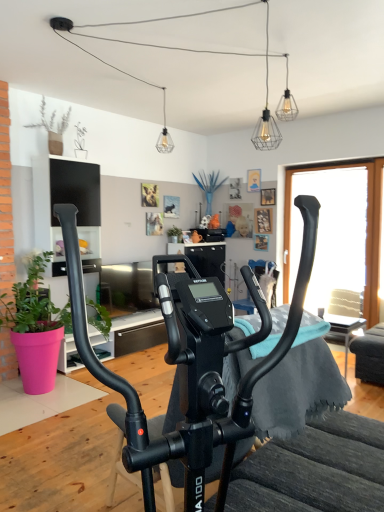
Question: Is black matte stationary bicycle at center inside the boundaries of clear glass pendant light at upper center, marked as the third light fixture in a front-to-back arrangement, or outside?

Choices:
 (A) outside
 (B) inside

Answer: (A)

Question: Based on their sizes in the image, would you say black matte stationary bicycle at center is bigger or smaller than clear glass pendant light at upper center, arranged as the 1th light fixture when viewed from the left?

Choices:
 (A) big
 (B) small

Answer: (A)

Question: Which is nearer to the transparent glass window at right?

Choices:
 (A) wire mesh bulb at upper center, which is the 3th light fixture from left to right
 (B) green matte plant at center, which appears as the second houseplant when viewed from the front
 (C) clear glass pendant light at upper center, marked as the third light fixture in a front-to-back arrangement
 (D) pink matte plant pot at left, acting as the second houseplant starting from the top
 (E) wire mesh light fixture at upper center, which ranks as the 2th light fixture in right-to-left order

Answer: (E)

Question: Which object is the closest to the wire mesh bulb at upper center, the 2th light fixture when ordered from back to front?

Choices:
 (A) wire mesh light fixture at upper center, acting as the second light fixture starting from the left
 (B) transparent glass window at right
 (C) pink matte plant pot at left, which appears as the first houseplant when viewed from the front
 (D) green matte plant at center, positioned as the 2th houseplant in left-to-right order
 (E) clear glass pendant light at upper center, arranged as the 1th light fixture when viewed from the left

Answer: (A)